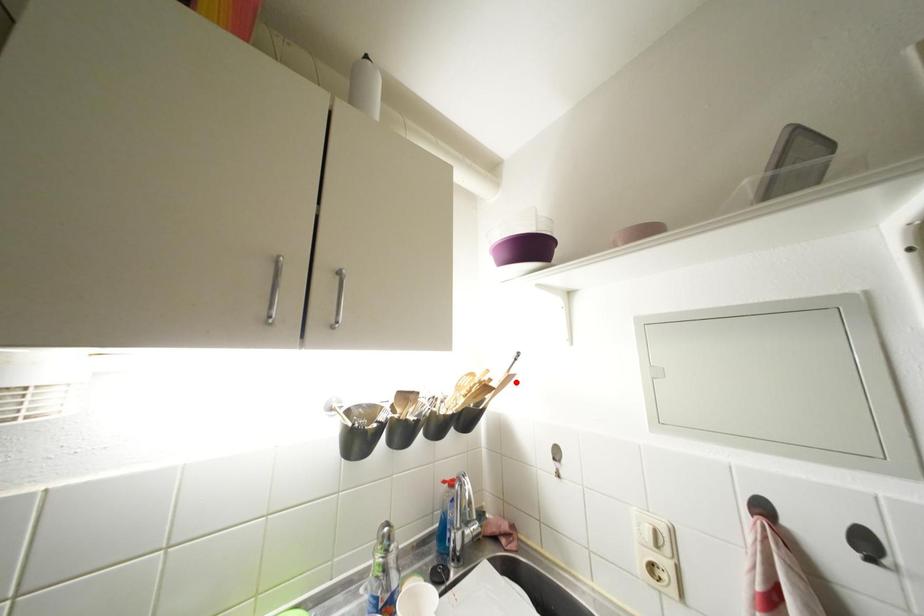
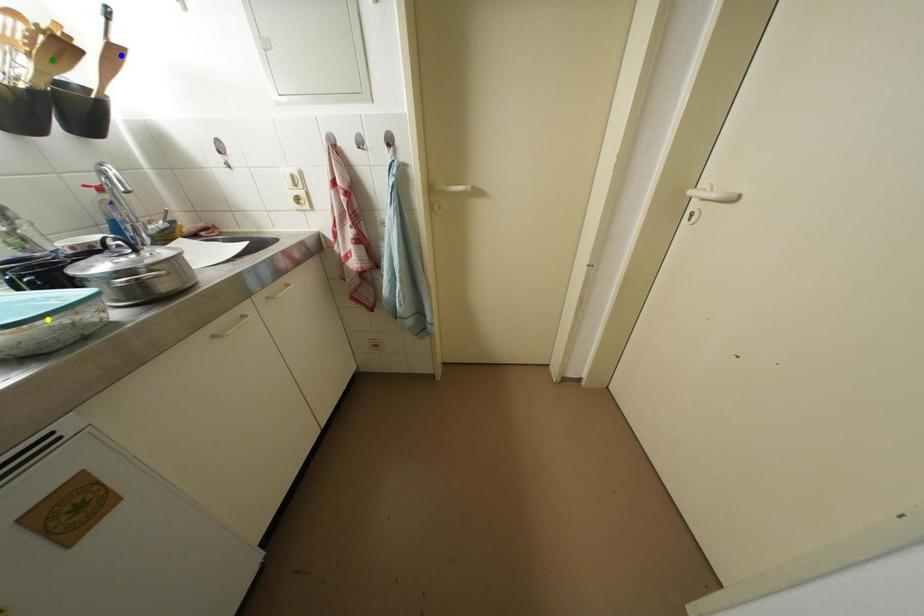
Question: I am providing you with two images of the same scene from different viewpoints. A red point is marked on the first image. You are given multiple points on the second image. Which point in image 2 represents the same 3d spot as the red point in image 1?

Choices:
 (A) blue point
 (B) green point
 (C) yellow point

Answer: (A)